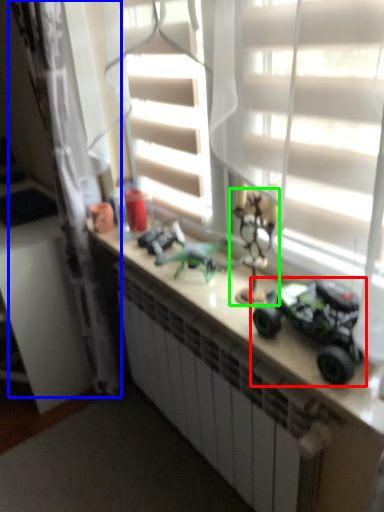
Question: Which object is positioned closest to toy (highlighted by a red box)? Select from curtain (highlighted by a blue box) and toy (highlighted by a green box).

Choices:
 (A) curtain
 (B) toy

Answer: (B)